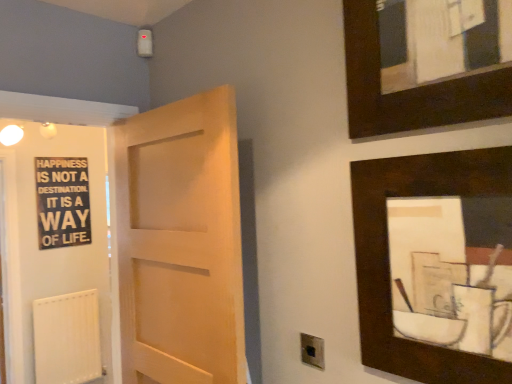
Question: Is dark wood picture frame at upper right, which is counted as the 2th picture frame, starting from the top, positioned with its back to dark wood picture frame at upper right, marked as the first picture frame in a top-to-bottom arrangement?

Choices:
 (A) yes
 (B) no

Answer: (B)

Question: Does dark wood picture frame at upper right, which is counted as the 2th picture frame, starting from the top, come behind dark wood picture frame at upper right, marked as the first picture frame in a top-to-bottom arrangement?

Choices:
 (A) no
 (B) yes

Answer: (B)

Question: Is dark wood picture frame at upper right, positioned as the 2th picture frame in bottom-to-top order, completely or partially inside dark wood picture frame at upper right, which appears as the first picture frame when ordered from the bottom?

Choices:
 (A) no
 (B) yes

Answer: (A)

Question: Is dark wood picture frame at upper right, which appears as the first picture frame when ordered from the bottom, taller than dark wood picture frame at upper right, positioned as the 2th picture frame in bottom-to-top order?

Choices:
 (A) yes
 (B) no

Answer: (A)

Question: Is dark wood picture frame at upper right, which appears as the first picture frame when ordered from the bottom, not within dark wood picture frame at upper right, marked as the first picture frame in a top-to-bottom arrangement?

Choices:
 (A) yes
 (B) no

Answer: (A)

Question: From the image's perspective, is black matte signboard at left located above or below metallic silver electric outlet at lower center?

Choices:
 (A) below
 (B) above

Answer: (B)

Question: In terms of width, does black matte signboard at left look wider or thinner when compared to metallic silver electric outlet at lower center?

Choices:
 (A) wide
 (B) thin

Answer: (A)

Question: Is point (91, 256) closer or farther from the camera than point (305, 337)?

Choices:
 (A) closer
 (B) farther

Answer: (B)

Question: In terms of height, does black matte signboard at left look taller or shorter compared to metallic silver electric outlet at lower center?

Choices:
 (A) short
 (B) tall

Answer: (B)

Question: From a real-world perspective, is light wood door at center above or below dark wood picture frame at upper right, which appears as the first picture frame when ordered from the bottom?

Choices:
 (A) below
 (B) above

Answer: (A)

Question: From their relative heights in the image, would you say light wood door at center is taller or shorter than dark wood picture frame at upper right, which appears as the first picture frame when ordered from the bottom?

Choices:
 (A) short
 (B) tall

Answer: (B)

Question: Is light wood door at center inside the boundaries of dark wood picture frame at upper right, which appears as the first picture frame when ordered from the bottom, or outside?

Choices:
 (A) inside
 (B) outside

Answer: (B)

Question: From the image's perspective, is light wood door at center positioned above or below dark wood picture frame at upper right, which appears as the first picture frame when ordered from the bottom?

Choices:
 (A) above
 (B) below

Answer: (B)

Question: From a real-world perspective, is metallic silver electric outlet at lower center physically located above or below black wood signboard at left?

Choices:
 (A) above
 (B) below

Answer: (B)

Question: Based on their sizes in the image, would you say metallic silver electric outlet at lower center is bigger or smaller than black wood signboard at left?

Choices:
 (A) small
 (B) big

Answer: (A)